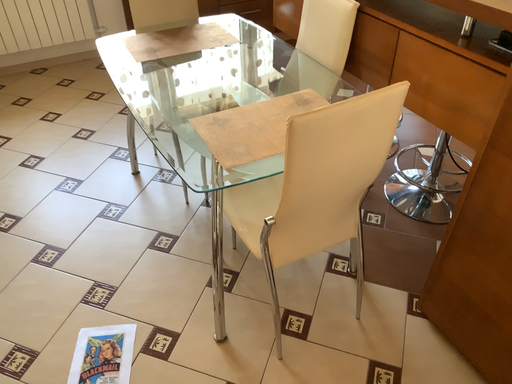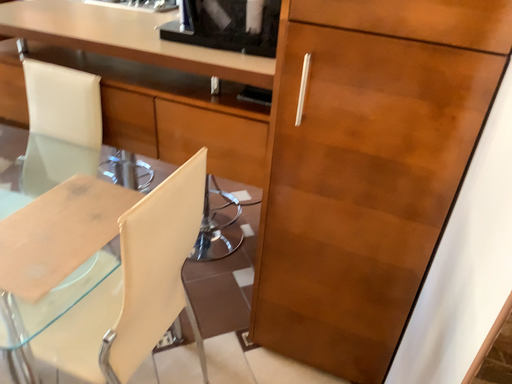
Question: Which way did the camera rotate in the video?

Choices:
 (A) rotated upward
 (B) rotated downward

Answer: (A)